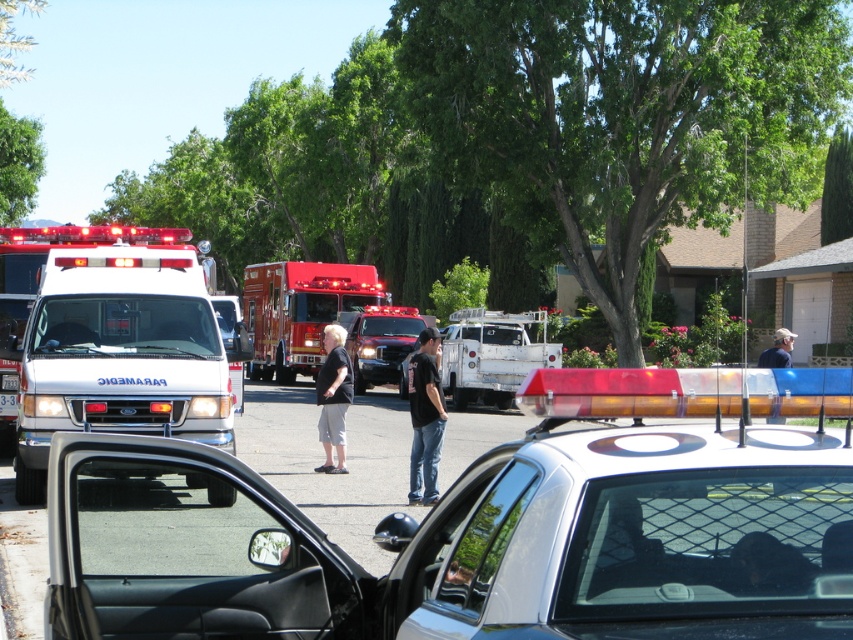
From the picture: You are a drone operator trying to capture a clear photo of the white glossy ambulance at left from the air. The drone is currently at point (119, 342). Is the drone directly above the ambulance?

The white glossy ambulance at left is located at point (119, 342), so yes, the drone is directly above the ambulance.

You are a firefighter assessing the scene. You notice the white glossy ambulance at left and the black cotton shorts at center. Which object is taller?

The white glossy ambulance at left is taller than the black cotton shorts at center.

You are a delivery person trying to navigate through the emergency scene. You need to move your delivery cart between the white matte truck at center and the black cotton shorts at center. Which object should you move closer to in order to have more space for your cart?

The black cotton shorts at center occupies more space than the white matte truck at center, so you should move closer to the black cotton shorts at center to have more space for your cart.